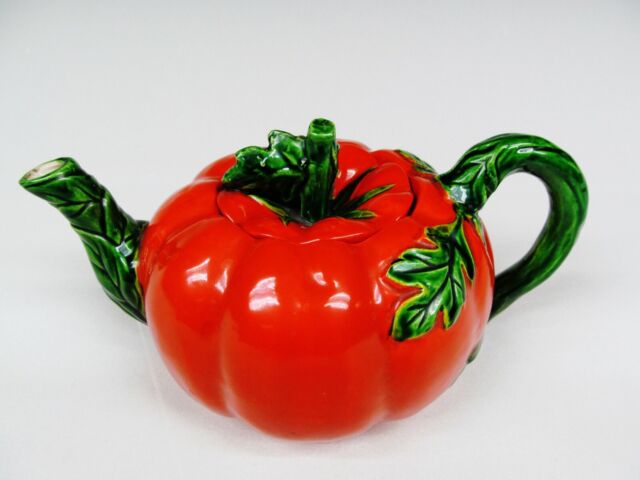
This screenshot has height=480, width=640. I want to click on decorative tea pot, so click(x=198, y=319).